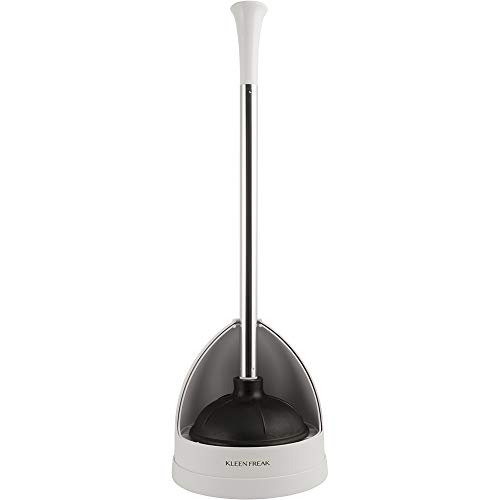
At what (x,y) coordinates should I click in order to perform the action: click on back of plunger stand. Please return your answer as a coordinate pair (x, y). This screenshot has height=500, width=500. Looking at the image, I should click on (220, 365).